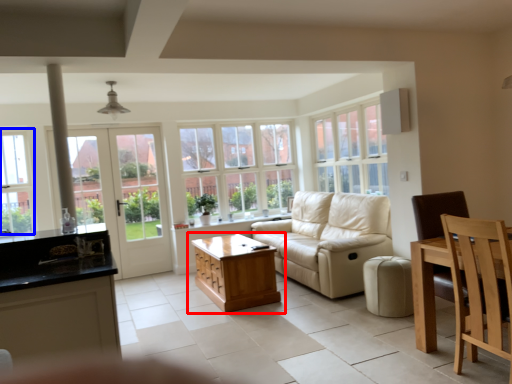
Question: Among these objects, which one is farthest to the camera, table (highlighted by a red box) or window (highlighted by a blue box)?

Choices:
 (A) table
 (B) window

Answer: (B)